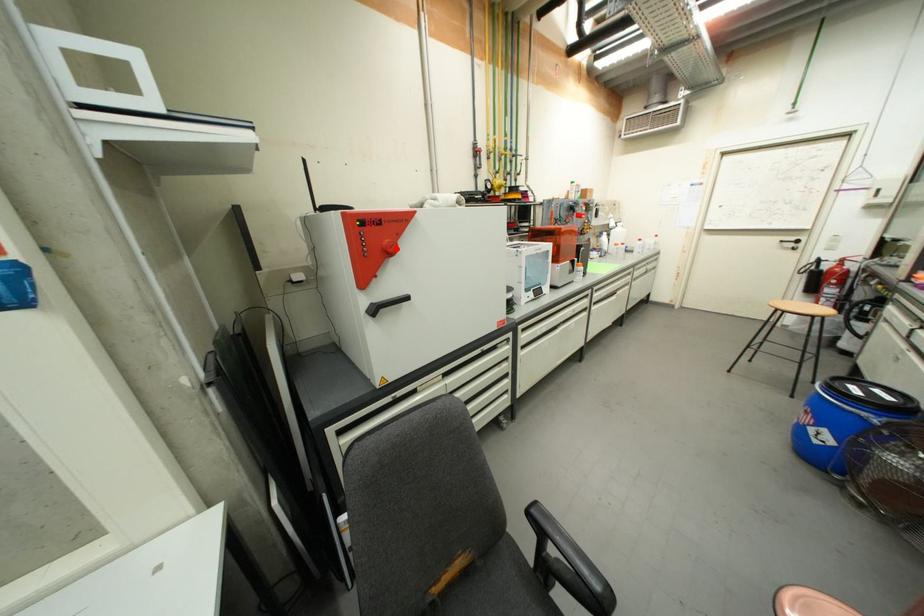
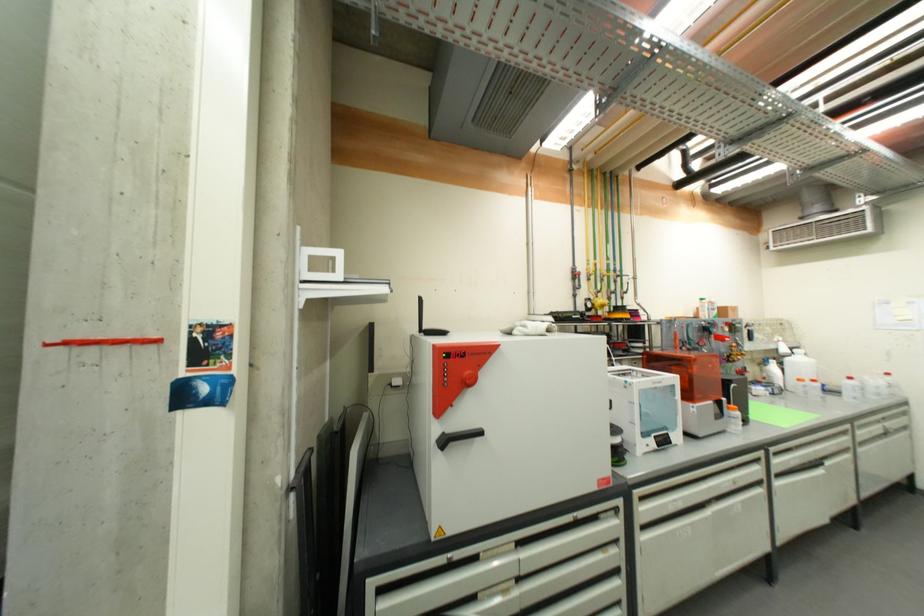
The point at the highlighted location is marked in the first image. Where is the corresponding point in the second image?

(476, 381)